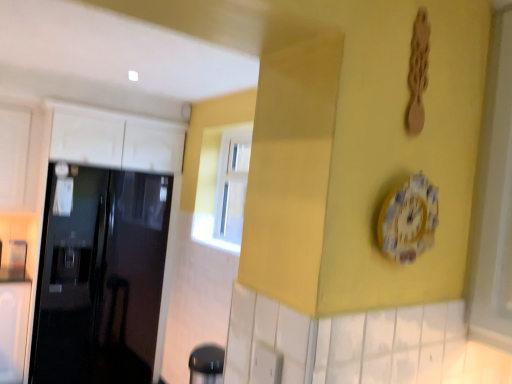
Question: Is porcelain floral clock at center oriented away from glossy black door at left?

Choices:
 (A) yes
 (B) no

Answer: (A)

Question: Can you confirm if porcelain floral clock at center is smaller than glossy black door at left?

Choices:
 (A) yes
 (B) no

Answer: (A)

Question: Considering the relative sizes of porcelain floral clock at center and glossy black door at left in the image provided, is porcelain floral clock at center wider than glossy black door at left?

Choices:
 (A) no
 (B) yes

Answer: (A)

Question: From the image's perspective, would you say porcelain floral clock at center is positioned over glossy black door at left?

Choices:
 (A) no
 (B) yes

Answer: (B)

Question: Is porcelain floral clock at center in front of glossy black door at left?

Choices:
 (A) yes
 (B) no

Answer: (A)

Question: Is porcelain floral clock at center taller than glossy black door at left?

Choices:
 (A) no
 (B) yes

Answer: (A)

Question: Does glossy black door at left have a lesser width compared to porcelain floral clock at center?

Choices:
 (A) no
 (B) yes

Answer: (A)

Question: Considering the relative positions of glossy black door at left and porcelain floral clock at center in the image provided, is glossy black door at left to the right of porcelain floral clock at center from the viewer's perspective?

Choices:
 (A) no
 (B) yes

Answer: (A)

Question: Is glossy black door at left outside of porcelain floral clock at center?

Choices:
 (A) no
 (B) yes

Answer: (B)

Question: Does glossy black door at left touch porcelain floral clock at center?

Choices:
 (A) no
 (B) yes

Answer: (A)

Question: From the image's perspective, is glossy black door at left located beneath porcelain floral clock at center?

Choices:
 (A) yes
 (B) no

Answer: (A)

Question: From the image's perspective, is glossy black door at left over porcelain floral clock at center?

Choices:
 (A) no
 (B) yes

Answer: (A)

Question: Is glossy black door at left in front of or behind porcelain floral clock at center in the image?

Choices:
 (A) behind
 (B) front

Answer: (A)